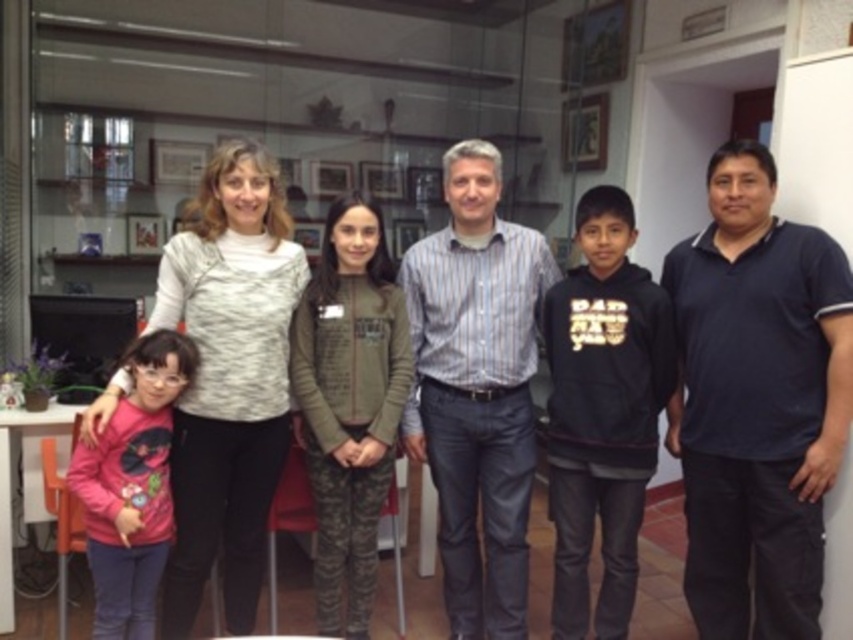
Based on the photo, based on the scene description, which object is positioned lower in the image? The dark blue polo shirt at right or the pink matte shirt at left?

The dark blue polo shirt at right is located below the pink matte shirt at left, so it is positioned lower in the image.

You are a photographer setting up for a group photo. You have a camera with a lens that can focus on objects up to 12 inches away. You notice the black fleece hoodie at center and the pink fabric at left in the scene. Can you focus on both items simultaneously with your current lens setting?

The black fleece hoodie at center and pink fabric at left are 11.55 inches apart from each other. Since the distance between them is within the 12 inches focus range of your lens, you can focus on both items simultaneously.